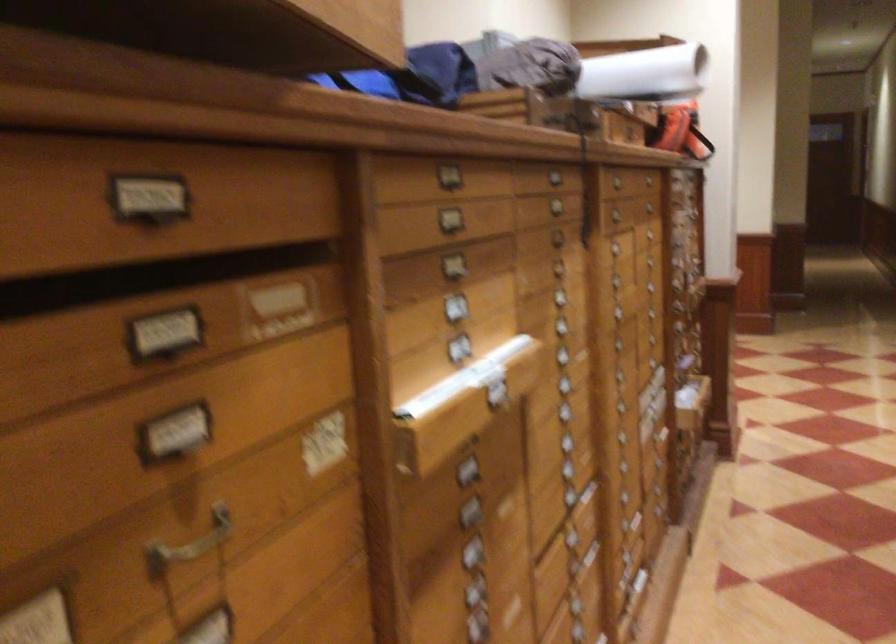
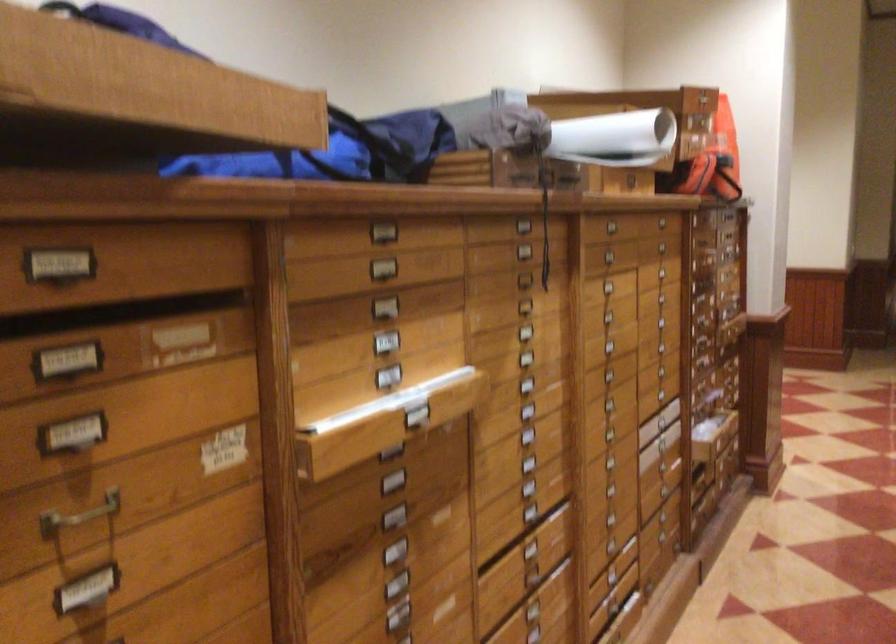
Locate, in the second image, the point that corresponds to (x=643, y=80) in the first image.

(615, 138)